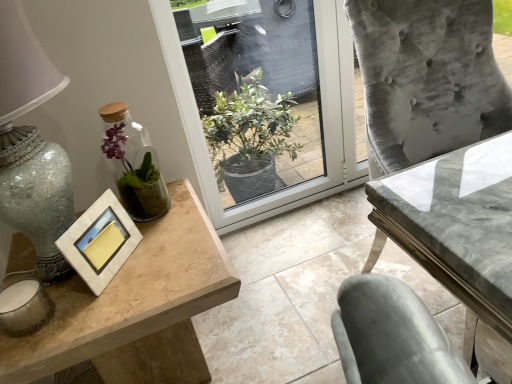
I want to click on free point to the right of matte silver picture frame at left, so click(x=168, y=259).